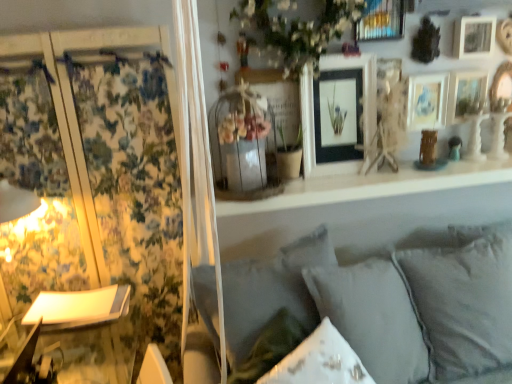
Question: From a real-world perspective, is white matte flower at upper center physically located above or below gray fabric pillow at lower center, marked as the 2th pillow in a right-to-left arrangement?

Choices:
 (A) below
 (B) above

Answer: (B)

Question: From the image's perspective, is white matte flower at upper center above or below gray fabric pillow at lower center, marked as the 2th pillow in a right-to-left arrangement?

Choices:
 (A) below
 (B) above

Answer: (B)

Question: Estimate the real-world distances between objects in this image. Which object is closer to the white matte flower at upper center?

Choices:
 (A) metallic gold picture frame at upper center, arranged as the fifth picture frame when viewed from the right
 (B) floral fabric curtain at left
 (C) matte white picture frame at upper right, which appears as the 4th picture frame when viewed from the right
 (D) matte black picture frame at upper center, arranged as the sixth picture frame when viewed from the right
 (E) wooden picture frame at upper right, the 6th picture frame positioned from the left

Answer: (D)

Question: Which object is positioned farthest from the floral fabric curtain at left?

Choices:
 (A) white glossy table lamp at left
 (B) matte black picture frame at upper center, arranged as the sixth picture frame when viewed from the right
 (C) wooden picture frame at upper right, the 6th picture frame positioned from the left
 (D) white soft cushions at lower right
 (E) matte white picture frame at upper right, the 5th picture frame viewed from the left

Answer: (C)